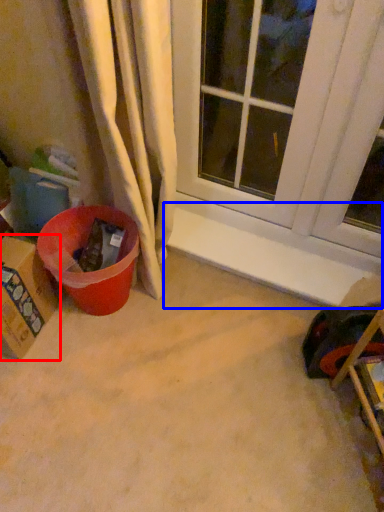
Question: Which object appears closest to the camera in this image, cardboard box (highlighted by a red box) or window sill (highlighted by a blue box)?

Choices:
 (A) cardboard box
 (B) window sill

Answer: (A)